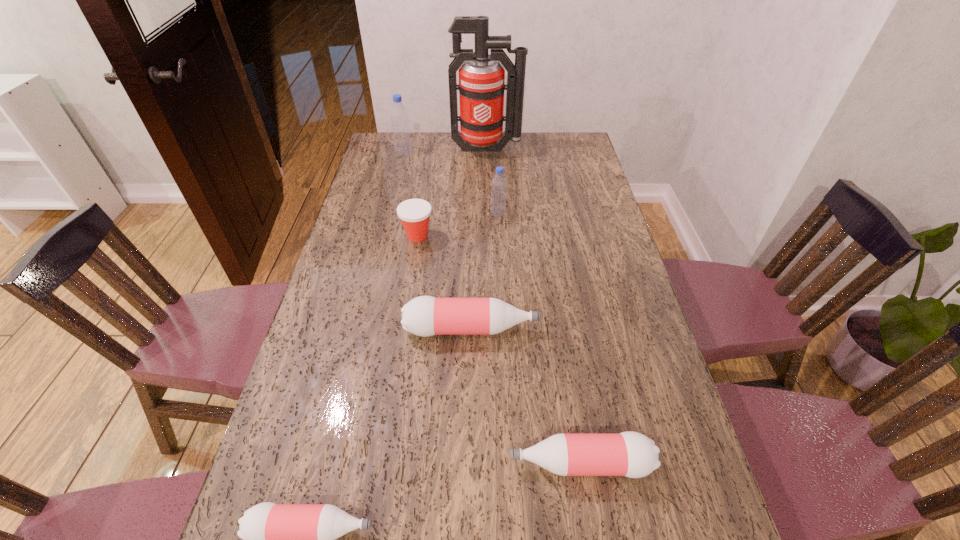
Find the location of a particular element. Image resolution: width=960 pixels, height=540 pixels. the second nearest bottle is located at coordinates (631, 454).

Where is `the second farthest pink bottle`? the second farthest pink bottle is located at coordinates (631, 454).

Find the location of a particular element. free point located on the front label side of the tallest object is located at coordinates (488, 210).

The height and width of the screenshot is (540, 960). I want to click on vacant space located on the right of the bigger blue bottle, so click(446, 153).

Locate an element on the screen. This screenshot has height=540, width=960. vacant space positioned 0.180m on the front of the right blue bottle is located at coordinates (500, 253).

The image size is (960, 540). I want to click on vacant space located 0.300m on the front of the fourth farthest object, so click(x=404, y=319).

The width and height of the screenshot is (960, 540). In order to click on free space located with the cap open on the third nearest bottle in this screenshot , I will do 577,329.

Identify the location of blank space located with the cap open on the second farthest pink bottle. (347, 463).

Image resolution: width=960 pixels, height=540 pixels. Find the location of `free point located 0.370m with the cap open on the second farthest pink bottle`. free point located 0.370m with the cap open on the second farthest pink bottle is located at coordinates (332, 463).

The height and width of the screenshot is (540, 960). I want to click on vacant region located with the cap open on the second farthest pink bottle, so click(x=356, y=463).